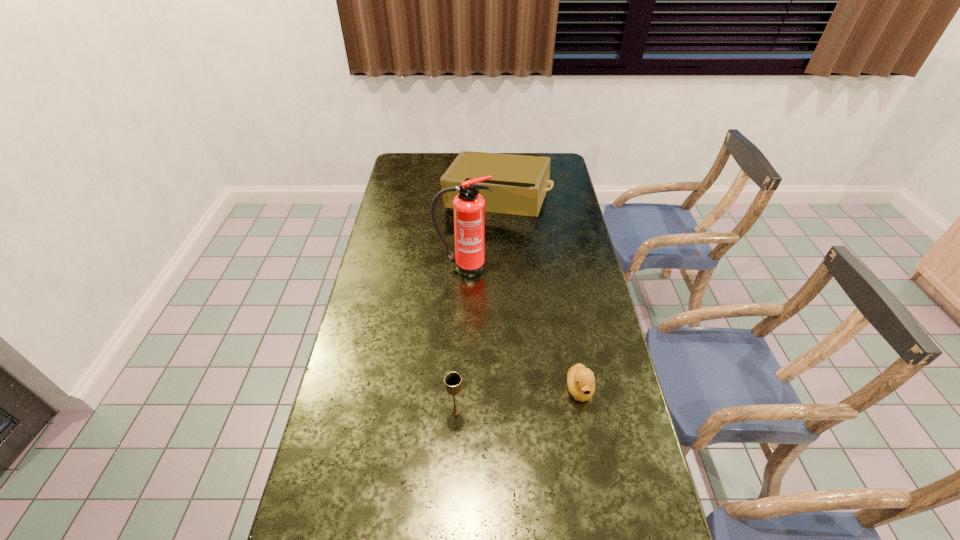
The image size is (960, 540). I want to click on blank region between the second farthest object and the duckling, so click(521, 328).

The height and width of the screenshot is (540, 960). What are the coordinates of `free space between the chalice and the duckling` in the screenshot? It's located at (517, 401).

Locate which object ranks third in proximity to the leftmost object. Please provide its 2D coordinates. Your answer should be formatted as a tuple, i.e. [(x, y)], where the tuple contains the x and y coordinates of a point satisfying the conditions above.

[(468, 206)]

The width and height of the screenshot is (960, 540). I want to click on the second closest object relative to the second shortest object, so click(468, 206).